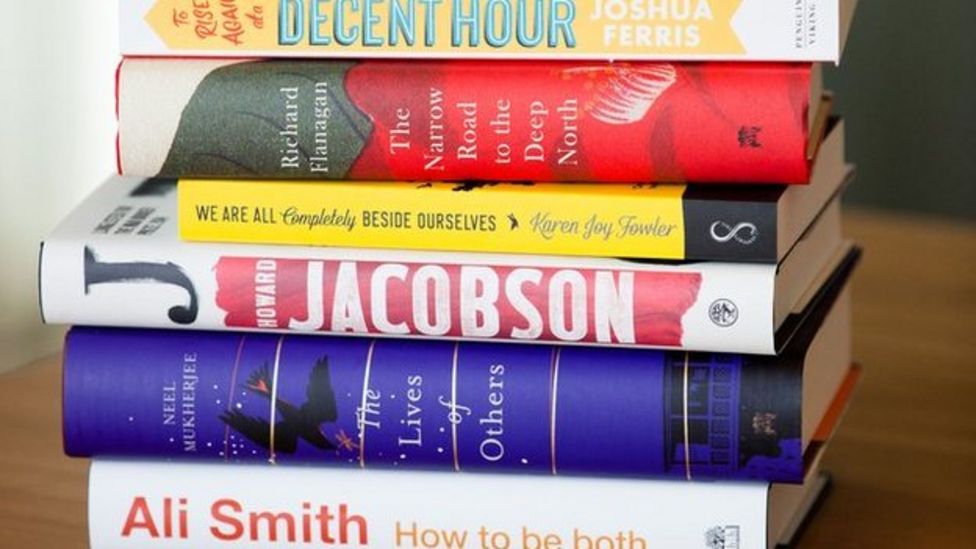
Where is `books`? Image resolution: width=976 pixels, height=549 pixels. books is located at coordinates (509, 18), (497, 122), (441, 225), (386, 294), (371, 416), (379, 519).